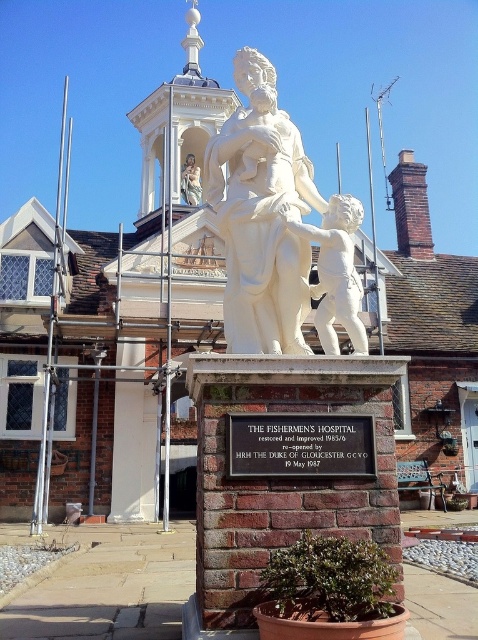
You are standing at the camera position and want to take a photo of the white marble statue at center. If your camera has a maximum focus range of 4 meters, will you be able to capture the statue clearly?

The white marble statue at center and camera are 4.62 meters apart from each other. Since the distance exceeds the camera maximum focus range of 4 meters, you will not be able to capture the statue clearly.

You are a tourist standing at the point marked as point (x=261, y=216). You want to take a photo of the white marble statue at center. Is the statue visible from your current position?

The statue is located at the point marked as point (x=261, y=216), so you are standing right at the statue. Therefore, the statue is visible from your current position.